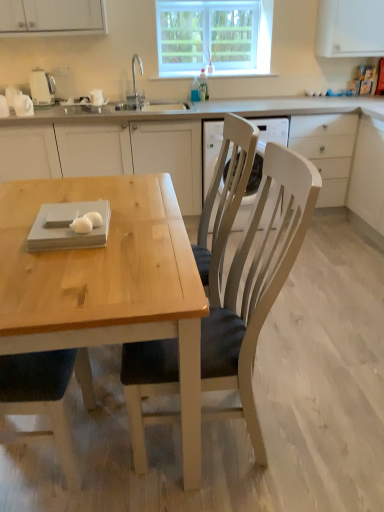
Question: Can you confirm if clear glass window at upper center is positioned to the right of wooden chair at center?

Choices:
 (A) yes
 (B) no

Answer: (A)

Question: From a real-world perspective, is clear glass window at upper center below wooden chair at center?

Choices:
 (A) no
 (B) yes

Answer: (A)

Question: Can wooden chair at center be found inside clear glass window at upper center?

Choices:
 (A) yes
 (B) no

Answer: (B)

Question: From the image's perspective, is clear glass window at upper center beneath wooden chair at center?

Choices:
 (A) no
 (B) yes

Answer: (A)

Question: Does clear glass window at upper center have a lesser width compared to wooden chair at center?

Choices:
 (A) no
 (B) yes

Answer: (B)

Question: Would you say wooden chair at center is to the left or to the right of white glossy egg at table, the second food in the front-to-back sequence, in the picture?

Choices:
 (A) left
 (B) right

Answer: (B)

Question: Considering the positions of point (266, 304) and point (96, 214), is point (266, 304) closer or farther from the camera than point (96, 214)?

Choices:
 (A) closer
 (B) farther

Answer: (A)

Question: From the image's perspective, relative to white glossy egg at table, which is counted as the 1th food, starting from the back, is wooden chair at center above or below?

Choices:
 (A) above
 (B) below

Answer: (B)

Question: Relative to white glossy egg at table, the second food in the front-to-back sequence, is wooden chair at center in front or behind?

Choices:
 (A) behind
 (B) front

Answer: (B)

Question: Considering their positions, is white glossy egg at table, which is counted as the 2th food, starting from the back, located in front of or behind white matte drawer at center right?

Choices:
 (A) behind
 (B) front

Answer: (B)

Question: Is white glossy egg at table, which is counted as the 2th food, starting from the back, taller or shorter than white matte drawer at center right?

Choices:
 (A) short
 (B) tall

Answer: (A)

Question: Choose the correct answer: Is white glossy egg at table, which is counted as the 2th food, starting from the back, inside white matte drawer at center right or outside it?

Choices:
 (A) outside
 (B) inside

Answer: (A)

Question: In terms of width, does white glossy egg at table, which is counted as the 2th food, starting from the back, look wider or thinner when compared to white matte drawer at center right?

Choices:
 (A) wide
 (B) thin

Answer: (B)

Question: Considering the positions of wooden chair at center and clear glass window at upper center in the image, is wooden chair at center wider or thinner than clear glass window at upper center?

Choices:
 (A) thin
 (B) wide

Answer: (B)

Question: From the image's perspective, is wooden chair at center located above or below clear glass window at upper center?

Choices:
 (A) below
 (B) above

Answer: (A)